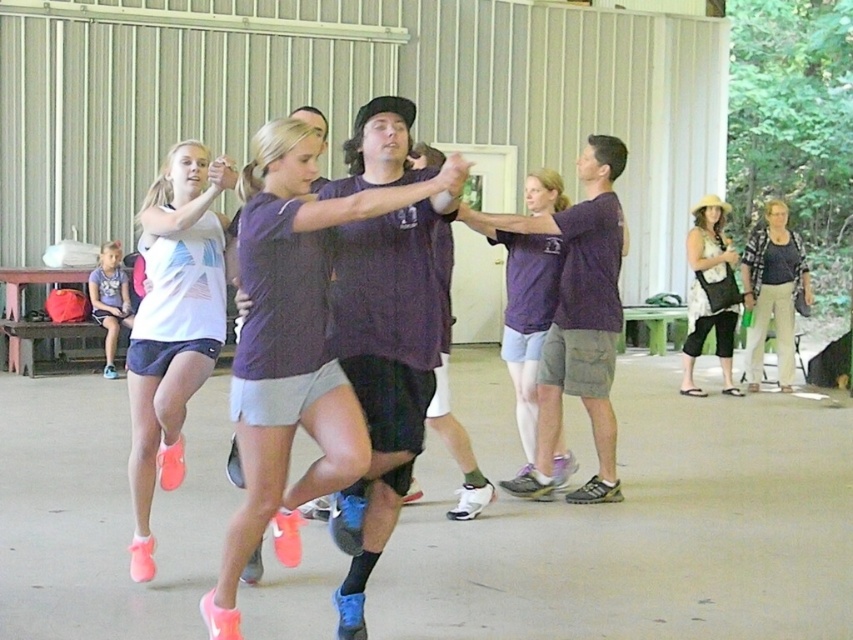
Question: Is pink matte shorts at center to the right of purple cotton shorts at center from the viewer's perspective?

Choices:
 (A) yes
 (B) no

Answer: (B)

Question: Observing the image, what is the correct spatial positioning of purple cotton shorts at center in reference to beige straw hat at upper right?

Choices:
 (A) right
 (B) left

Answer: (B)

Question: Which point appears farthest from the camera in this image?

Choices:
 (A) (751, 298)
 (B) (708, 252)
 (C) (171, 304)
 (D) (247, 536)

Answer: (A)

Question: Which object is farther from the camera taking this photo?

Choices:
 (A) dark blue shirt at right
 (B) purple cotton shorts at center
 (C) purple matte t-shirt at center

Answer: (A)

Question: Estimate the real-world distances between objects in this image. Which object is closer to the beige straw hat at upper right?

Choices:
 (A) dark blue shirt at right
 (B) pink matte shorts at center
 (C) purple matte t-shirt at center

Answer: (A)

Question: Can you confirm if purple cotton t-shirt at center is positioned to the right of beige straw hat at upper right?

Choices:
 (A) yes
 (B) no

Answer: (B)